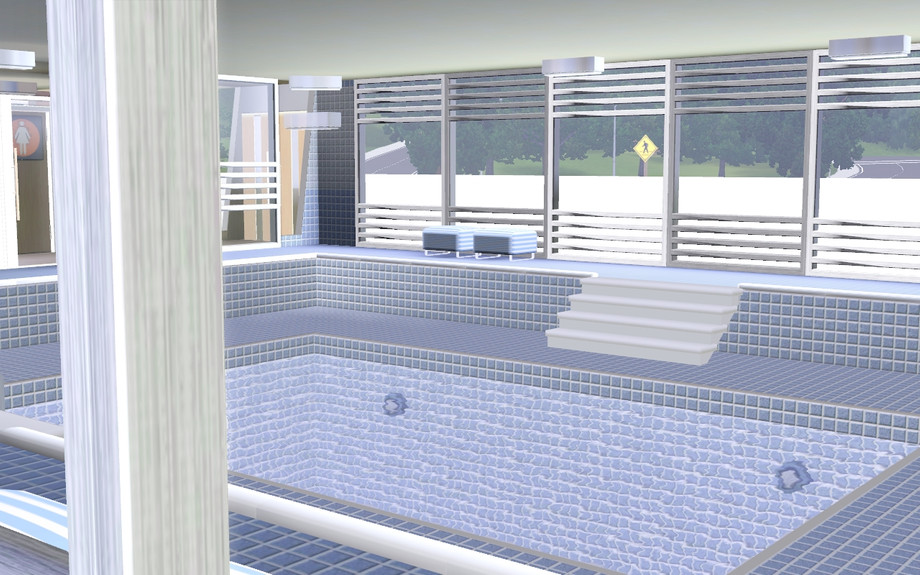
In order to click on bathroom door in this screenshot , I will do click(39, 240).